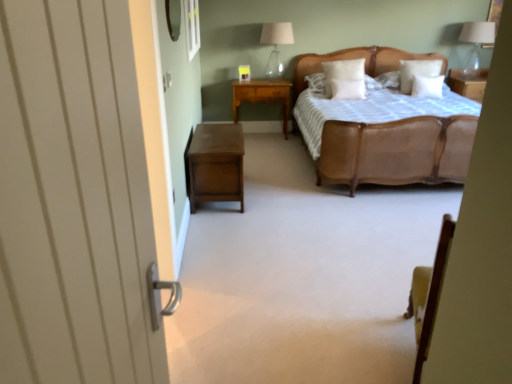
The image size is (512, 384). Find the location of `unoccupied region to the right of brown wood nightstand at lower left, marked as the 2th nightstand in a top-to-bottom arrangement`. unoccupied region to the right of brown wood nightstand at lower left, marked as the 2th nightstand in a top-to-bottom arrangement is located at coordinates (287, 191).